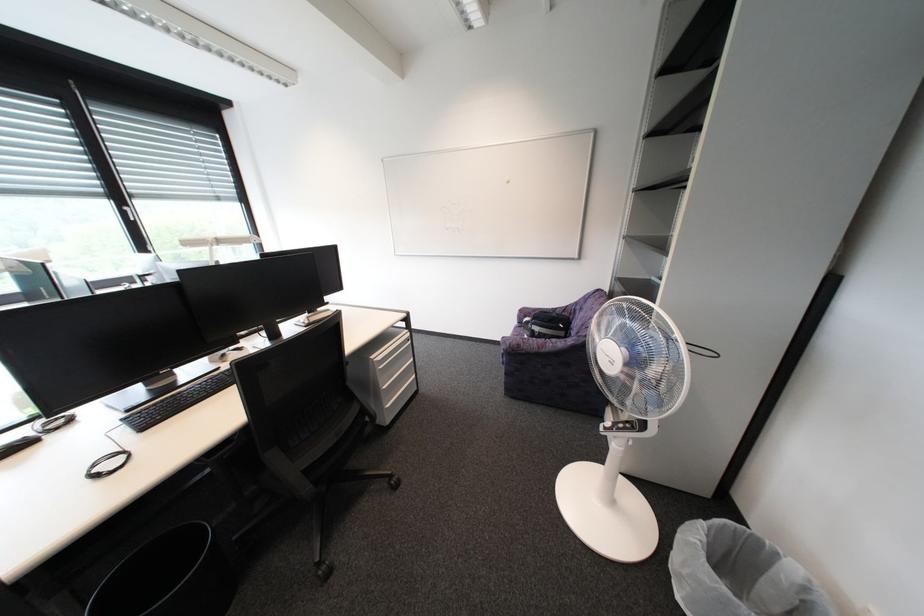
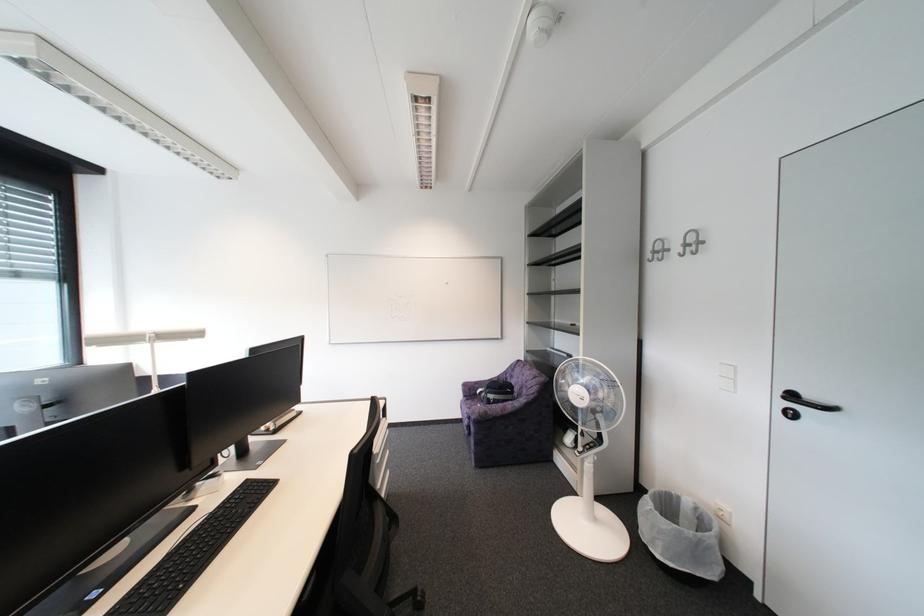
The images are taken continuously from a first-person perspective. In which direction is your viewpoint rotating?

The camera rotated toward right-up.